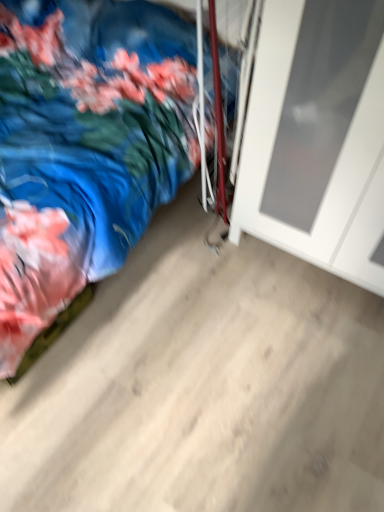
Locate an element on the screen. Image resolution: width=384 pixels, height=512 pixels. vacant space underneath white matte door at right (from a real-world perspective) is located at coordinates (300, 269).